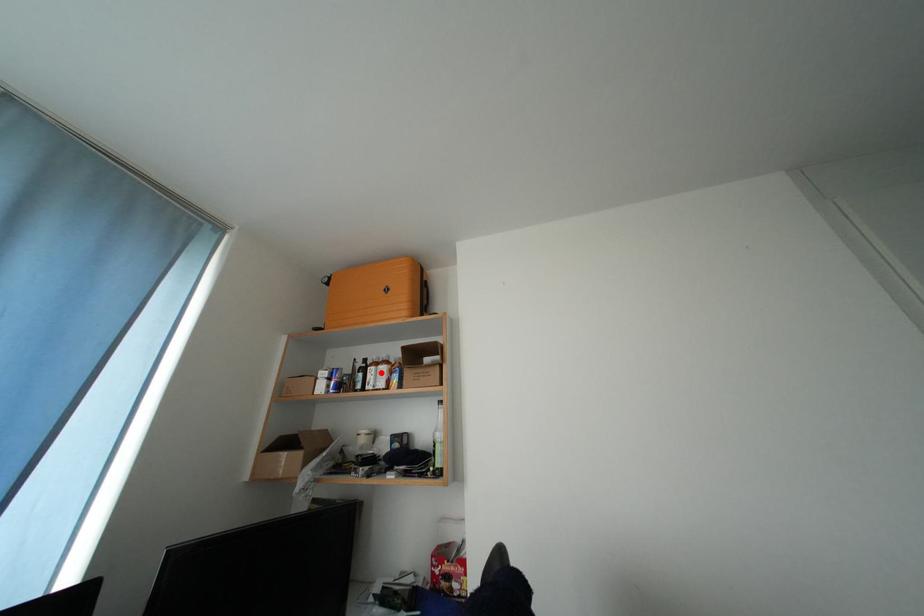
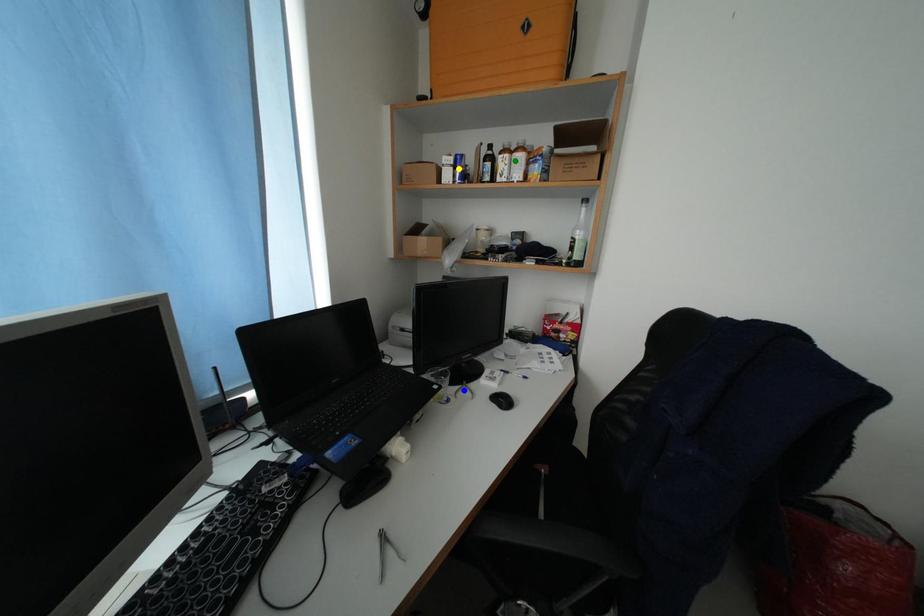
Question: I am providing you with two images of the same scene from different viewpoints. A red point is marked on the first image. You are given multiple points on the second image. Which mark in image 2 goes with the point in image 1?

Choices:
 (A) yellow point
 (B) blue point
 (C) green point

Answer: (C)